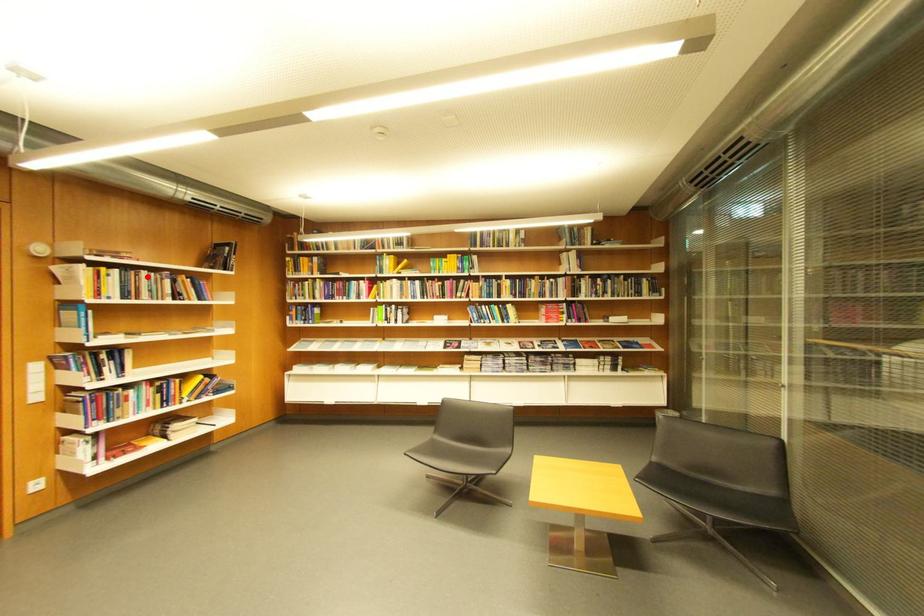
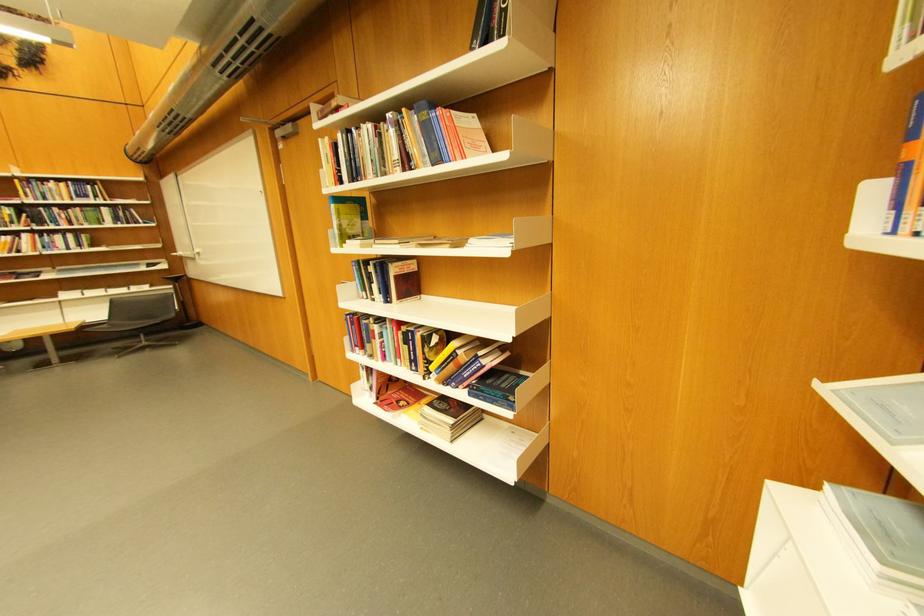
Find the pixel in the second image that matches the highlighted location in the first image.

(370, 137)